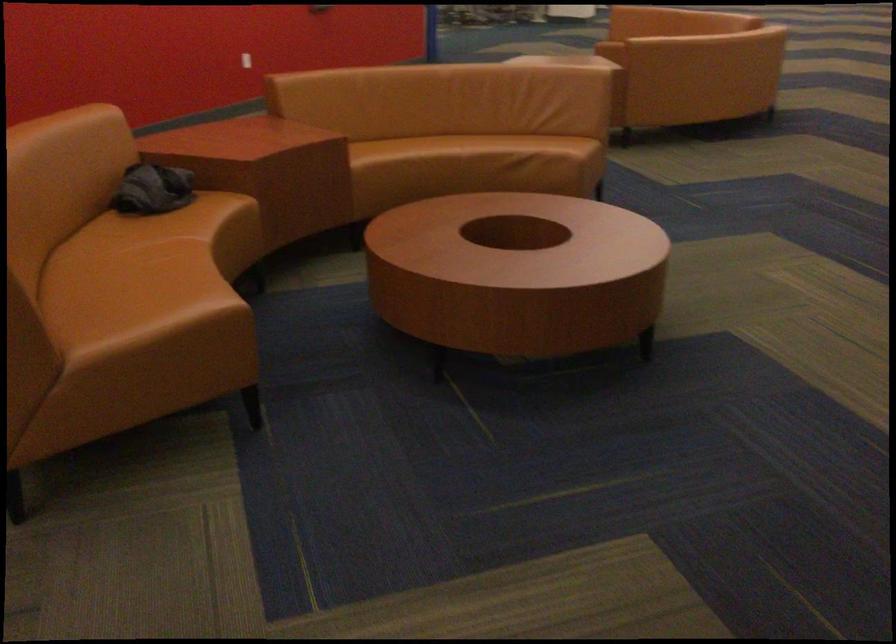
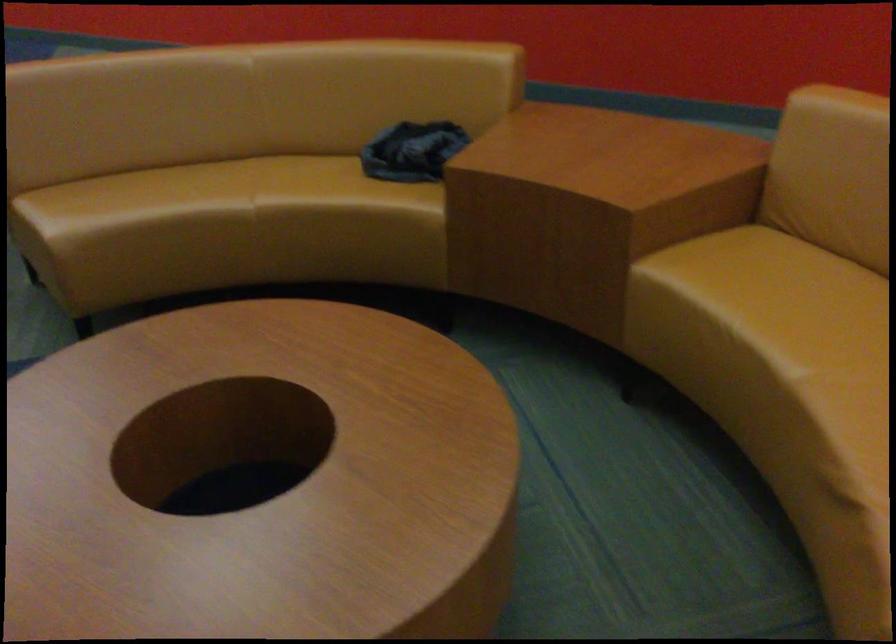
Find the pixel in the second image that matches point (418, 147) in the first image.

(814, 308)